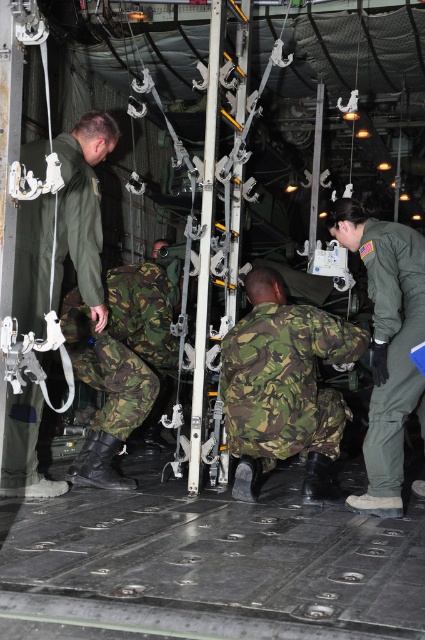
Is camouflage fabric uniform at center shorter than camo fabric pants at lower center?

Yes, camouflage fabric uniform at center is shorter than camo fabric pants at lower center.

Is camouflage fabric uniform at center to the left of camo fabric pants at lower center from the viewer's perspective?

Incorrect, camouflage fabric uniform at center is not on the left side of camo fabric pants at lower center.

I want to click on camouflage fabric uniform at center, so click(285, 381).

Who is higher up, green camouflage uniform at left or camouflage fabric uniform at center?

green camouflage uniform at left

Does green camouflage uniform at left appear over camouflage fabric uniform at center?

Yes, green camouflage uniform at left is above camouflage fabric uniform at center.

The height and width of the screenshot is (640, 425). Describe the element at coordinates (82, 208) in the screenshot. I see `green camouflage uniform at left` at that location.

The height and width of the screenshot is (640, 425). I want to click on green camouflage uniform at left, so click(82, 208).

Between camo fabric pants at lower center and green matte flight suit at right, which one has more height?

green matte flight suit at right

This screenshot has width=425, height=640. In order to click on camo fabric pants at lower center in this screenshot , I will do `click(124, 344)`.